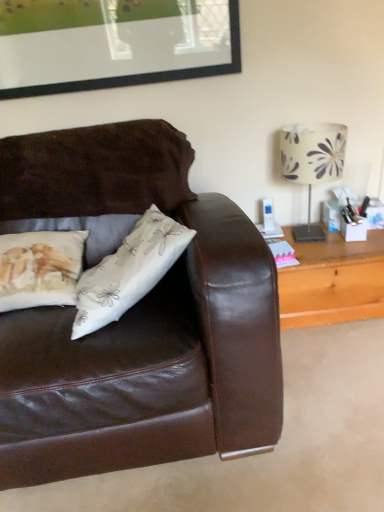
This screenshot has height=512, width=384. I want to click on vacant area in front of white floral-patterned lampshade at upper right, so click(332, 251).